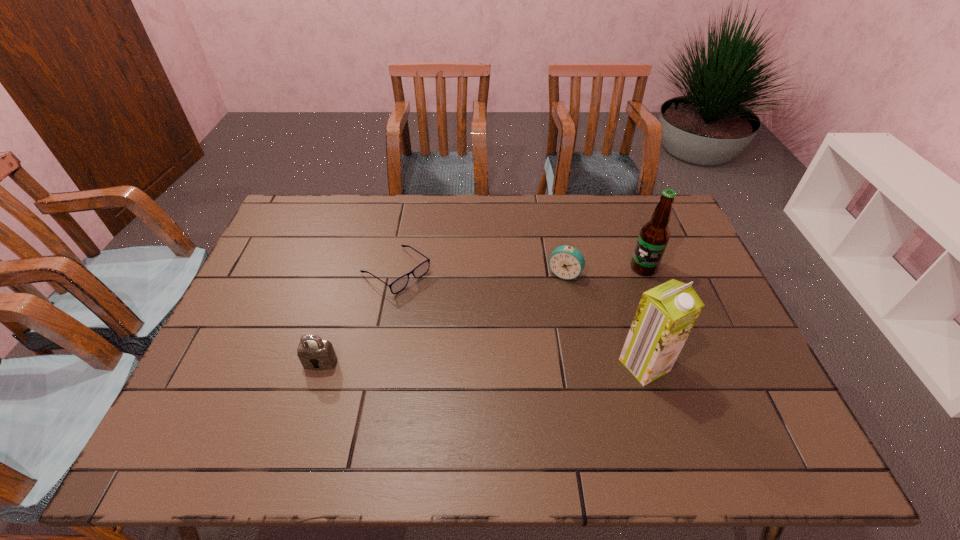
Where is `padlock`? This screenshot has height=540, width=960. padlock is located at coordinates (312, 349).

This screenshot has width=960, height=540. I want to click on soya milk, so click(666, 314).

Find the location of a particular element. Image resolution: width=960 pixels, height=540 pixels. alarm clock is located at coordinates (566, 262).

The image size is (960, 540). In order to click on beer bottle in this screenshot , I will do `click(654, 235)`.

Where is `the shortest object`? The height and width of the screenshot is (540, 960). the shortest object is located at coordinates (399, 284).

Find the location of a particular element. vacant space located 0.100m at the front of the padlock near the keyhole is located at coordinates (307, 407).

I want to click on vacant region located 0.370m on the back of the soya milk, so click(610, 252).

Identify the location of vacant area located 0.310m on the front-facing side of the alarm clock. (520, 362).

You are a GUI agent. You are given a task and a screenshot of the screen. Output one action in this format:
    pyautogui.click(x=<x>, y=<y>)
    Task: Click on the vacant space located 0.060m on the front-facing side of the alarm clock
    The width and height of the screenshot is (960, 540).
    Given the screenshot: What is the action you would take?
    pyautogui.click(x=552, y=297)

The image size is (960, 540). What are the coordinates of `free point located on the front-facing side of the alarm clock` in the screenshot? It's located at (524, 354).